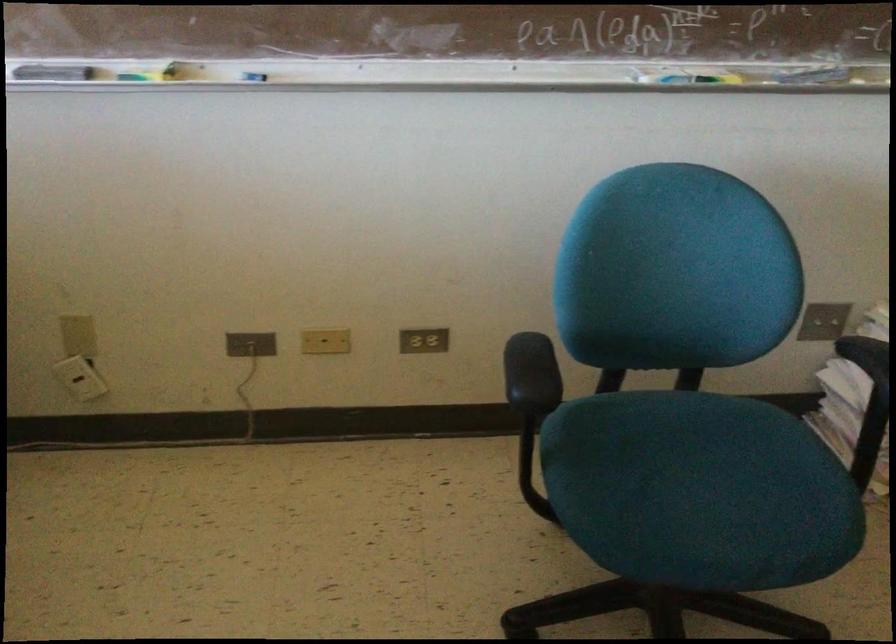
Where is `white light switch`? The width and height of the screenshot is (896, 644). white light switch is located at coordinates (423, 341).